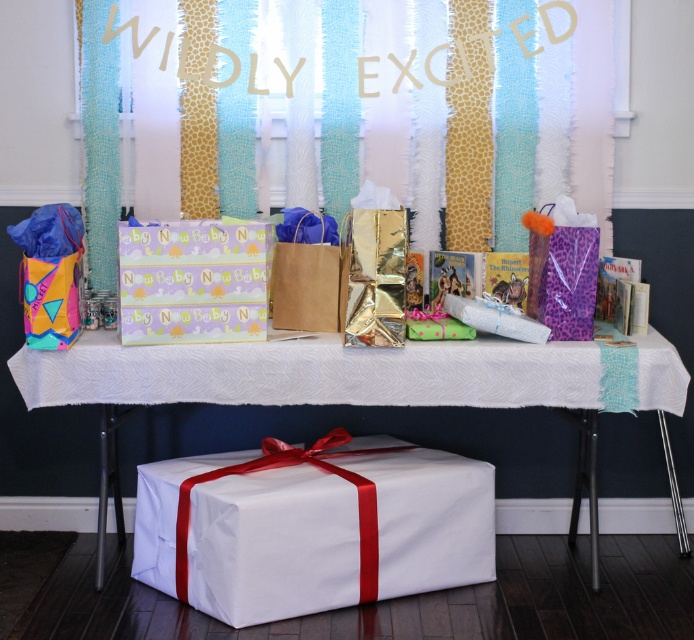
You are organizing the gifts on the table for a baby shower. You need to place a new gift between the gold reflective gift bag at center and the brown paper bag at center. Where should you place it to be between them?

The gold reflective gift bag at center is positioned on the right side of brown paper bag at center. To place the new gift between them, put it to the left of the gold reflective gift bag at center and to the right of the brown paper bag at center.

You are planning to place a decorative item on the table for the baby shower. The table has a white tablecloth with a textured pattern. There is a gift box with purple and green wrapping in the center. Where should you place the decorative item so it aligns with the giraffe print fabric at upper center located at point (499, 116)?

You should place the decorative item at point (499, 116) where the giraffe print fabric at upper center is located.